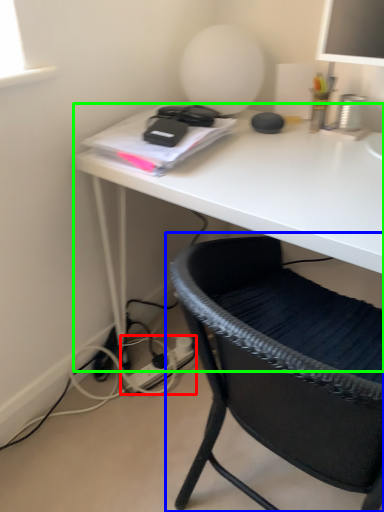
Question: Based on their relative distances, which object is farther from plug (highlighted by a red box)? Choose from chair (highlighted by a blue box) and desk (highlighted by a green box).

Choices:
 (A) chair
 (B) desk

Answer: (A)